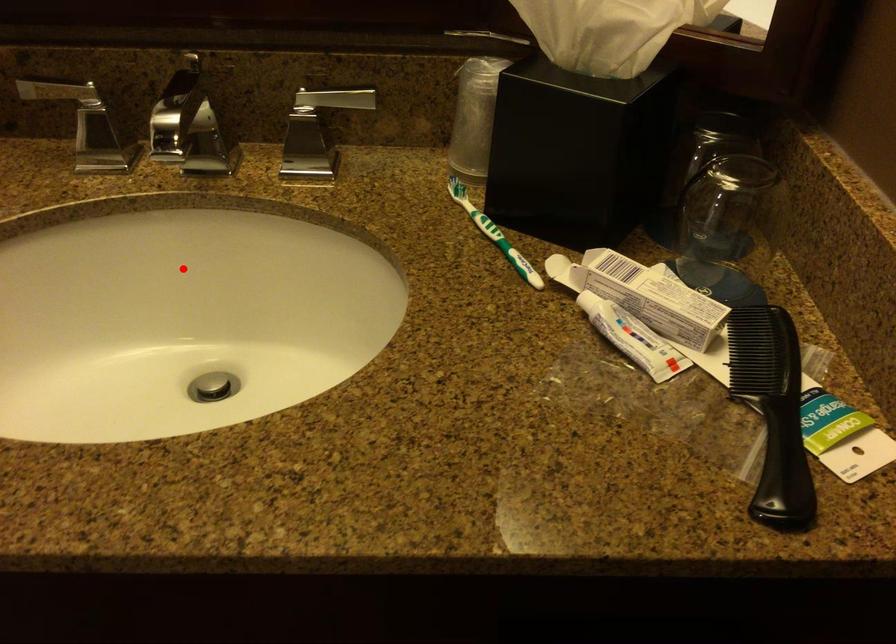
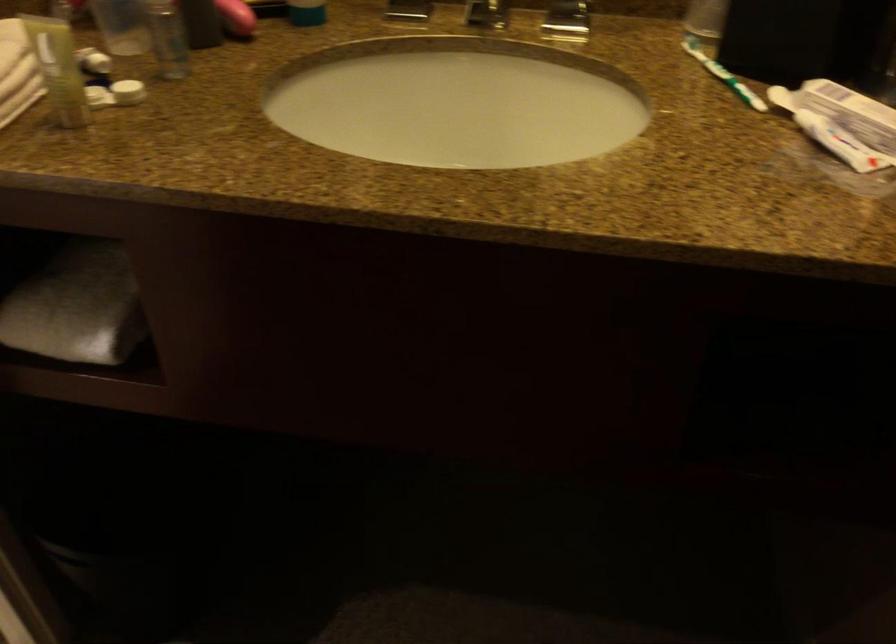
Question: I am providing you with two images of the same scene from different viewpoints. In image1, a red point is highlighted. Considering the same 3D point in image2, which of the following is correct?

Choices:
 (A) It is closer
 (B) It is farther

Answer: (B)